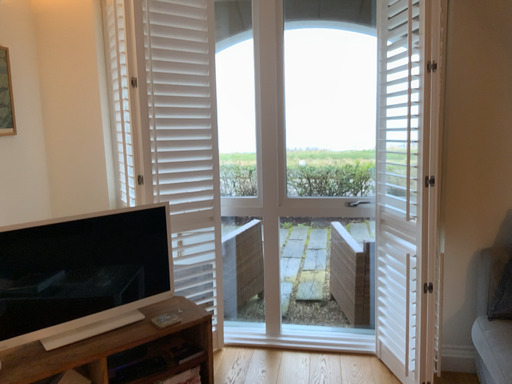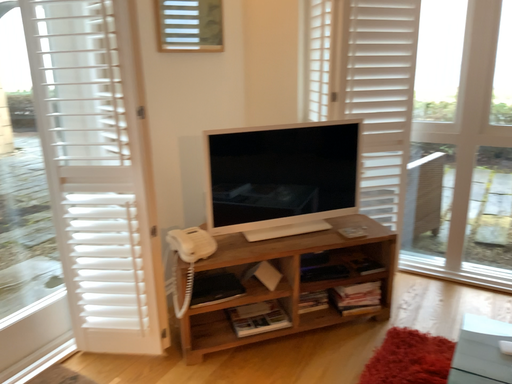
Question: Which way did the camera rotate in the video?

Choices:
 (A) rotated downward
 (B) rotated upward

Answer: (A)